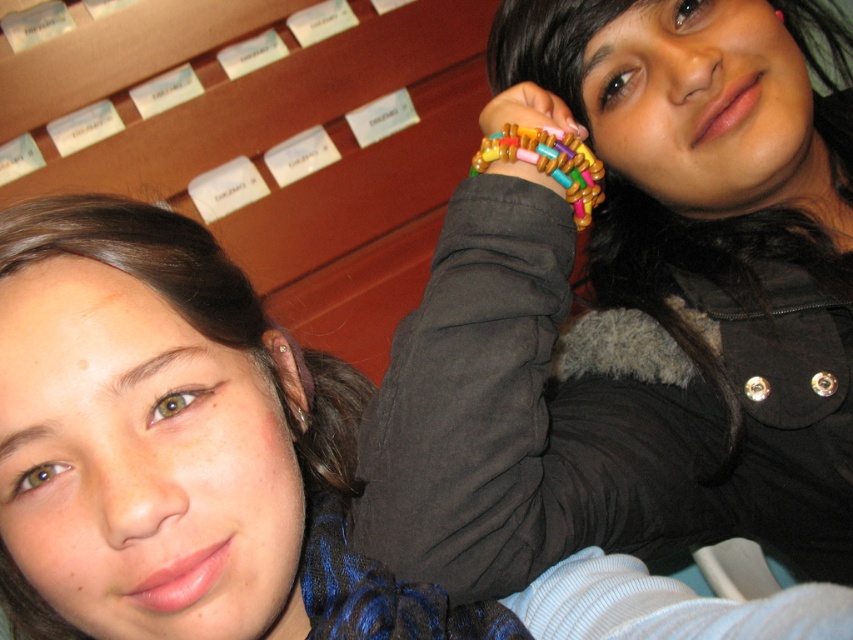
Can you confirm if multicolored beaded bracelet at upper right is positioned to the left of matte black jacket at upper right?

Incorrect, multicolored beaded bracelet at upper right is not on the left side of matte black jacket at upper right.

Which of these two, multicolored beaded bracelet at upper right or matte black jacket at upper right, stands shorter?

matte black jacket at upper right

Describe the element at coordinates (634, 310) in the screenshot. The width and height of the screenshot is (853, 640). I see `multicolored beaded bracelet at upper right` at that location.

This screenshot has width=853, height=640. Find the location of `multicolored beaded bracelet at upper right`. multicolored beaded bracelet at upper right is located at coordinates (634, 310).

Is the position of wooden beads at upper center less distant than that of beaded bracelet at center?

Yes, wooden beads at upper center is closer to the viewer.

Between wooden beads at upper center and beaded bracelet at center, which one has more height?

With more height is wooden beads at upper center.

Locate an element on the screen. Image resolution: width=853 pixels, height=640 pixels. wooden beads at upper center is located at coordinates (548, 163).

Where is `wooden beads at upper center`? The height and width of the screenshot is (640, 853). wooden beads at upper center is located at coordinates (548, 163).

Between multicolored beaded bracelet at upper right and wooden beads at upper center, which one is positioned lower?

Positioned lower is multicolored beaded bracelet at upper right.

Measure the distance between point [465,577] and camera.

Point [465,577] is 21.39 inches from camera.

Who is more forward, (465, 312) or (578, 209)?

Point (465, 312) is more forward.

At what (x,y) coordinates should I click in order to perform the action: click on multicolored beaded bracelet at upper right. Please return your answer as a coordinate pair (x, y). The image size is (853, 640). Looking at the image, I should click on (634, 310).